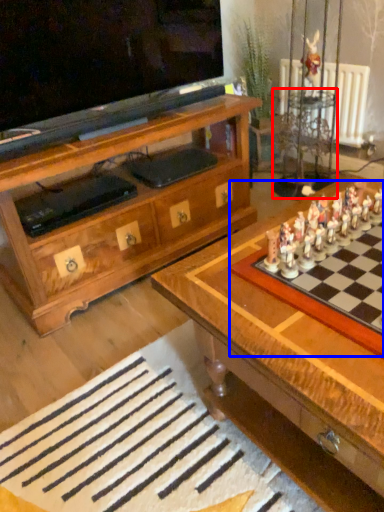
Question: Which object is closer to the camera taking this photo, side table (highlighted by a red box) or board game (highlighted by a blue box)?

Choices:
 (A) side table
 (B) board game

Answer: (B)